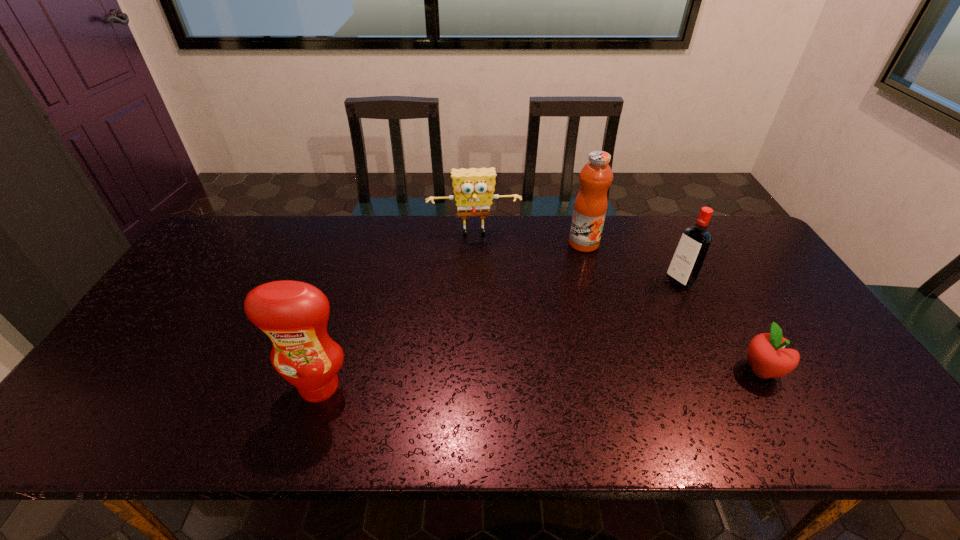
Locate an element on the screen. The height and width of the screenshot is (540, 960). free location located 0.050m on the front and back of the third nearest object is located at coordinates (660, 292).

Locate an element on the screen. The image size is (960, 540). vacant space located on the front label of the fruit juice is located at coordinates (587, 313).

Where is `vacant space situated on the front label of the fruit juice`? Image resolution: width=960 pixels, height=540 pixels. vacant space situated on the front label of the fruit juice is located at coordinates (585, 269).

Find the location of a particular element. The width and height of the screenshot is (960, 540). vacant area situated on the front label of the fruit juice is located at coordinates (585, 275).

Where is `free space located on the face of the sponge`? free space located on the face of the sponge is located at coordinates (480, 276).

I want to click on vacant space located 0.370m on the face of the sponge, so click(485, 325).

Find the location of a particular element. free point located on the face of the sponge is located at coordinates pos(481,283).

Locate an element on the screen. fruit juice that is positioned at the far edge is located at coordinates (590, 206).

I want to click on sponge that is positioned at the far edge, so click(x=473, y=188).

Find the location of a particular element. The height and width of the screenshot is (540, 960). condiment present at the near edge is located at coordinates (293, 314).